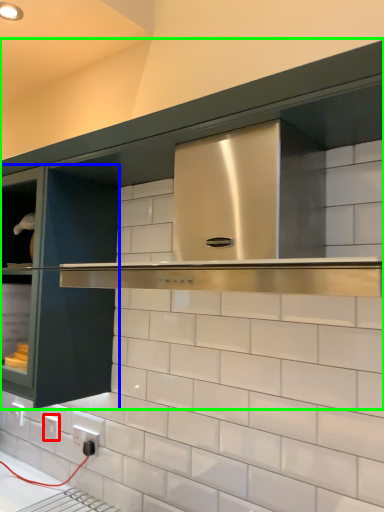
Question: Considering the real-world distances, which object is closest to electric outlet (highlighted by a red box)? glass door (highlighted by a blue box) or cabinetry (highlighted by a green box).

Choices:
 (A) glass door
 (B) cabinetry

Answer: (A)